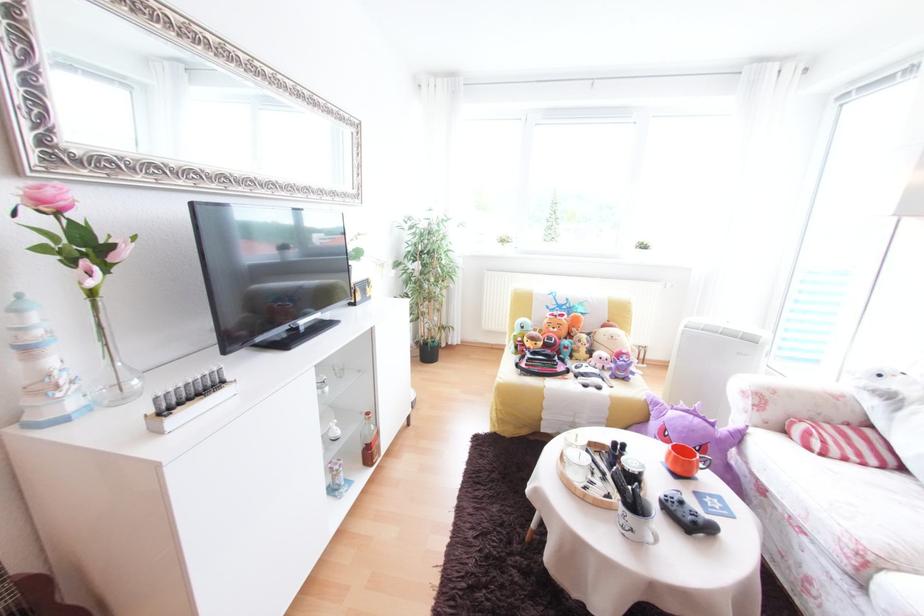
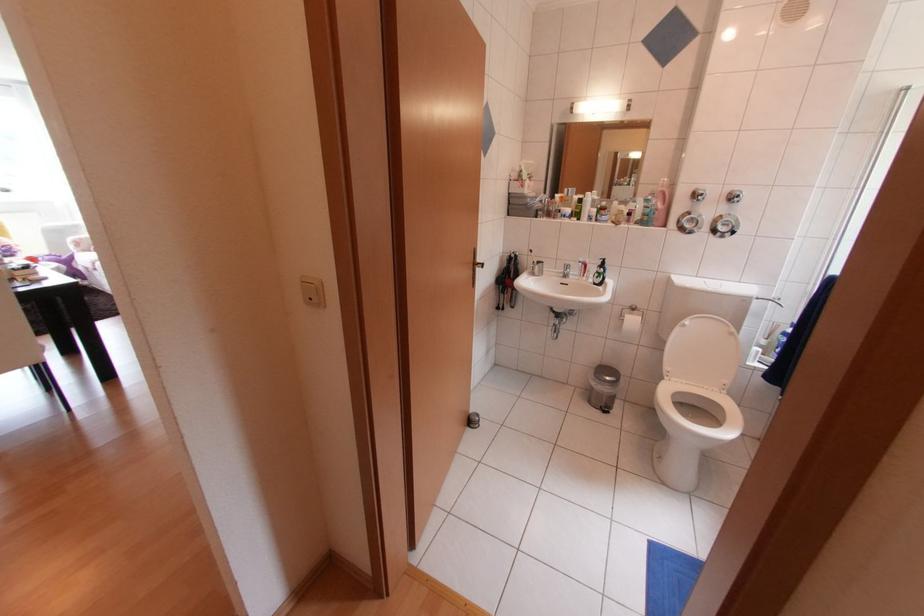
Question: I am providing you with two images of the same scene from different viewpoints. Please identify which objects are invisible in image2.

Choices:
 (A) orange ceramic mug
 (B) light wood drawer handle
 (C) toilet paper roll
 (D) small metal trashcan

Answer: (A)